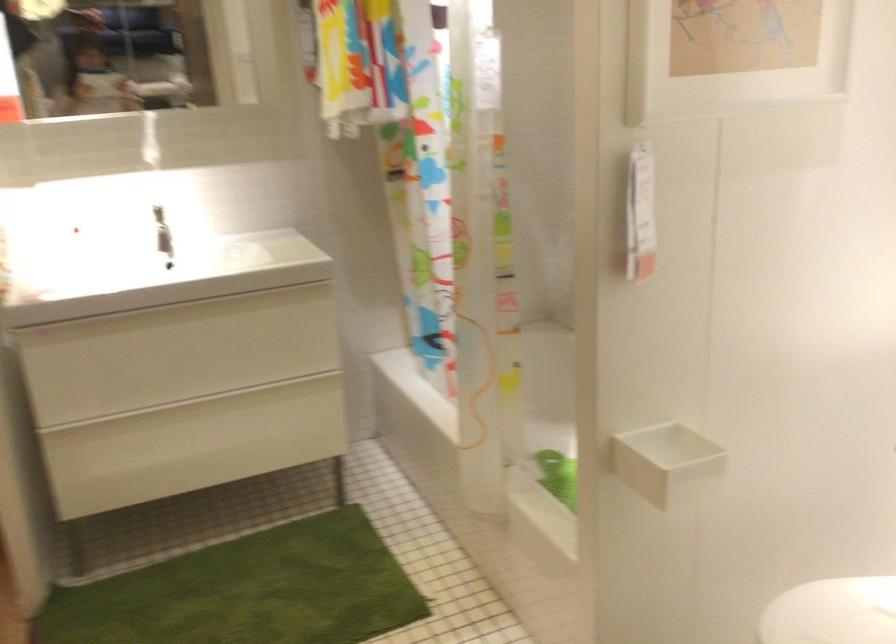
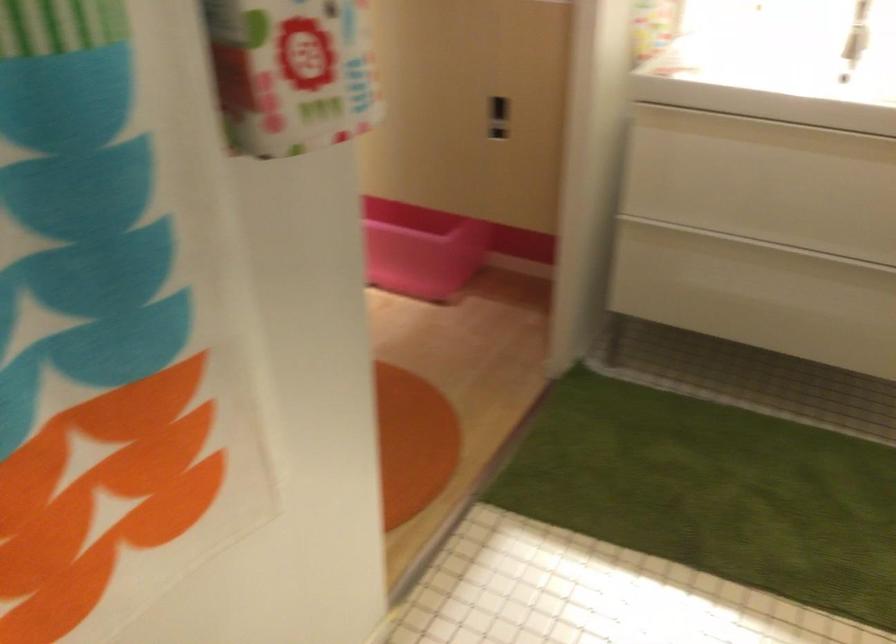
Where in the second image is the point corresponding to the point at 159,428 from the first image?

(734, 254)